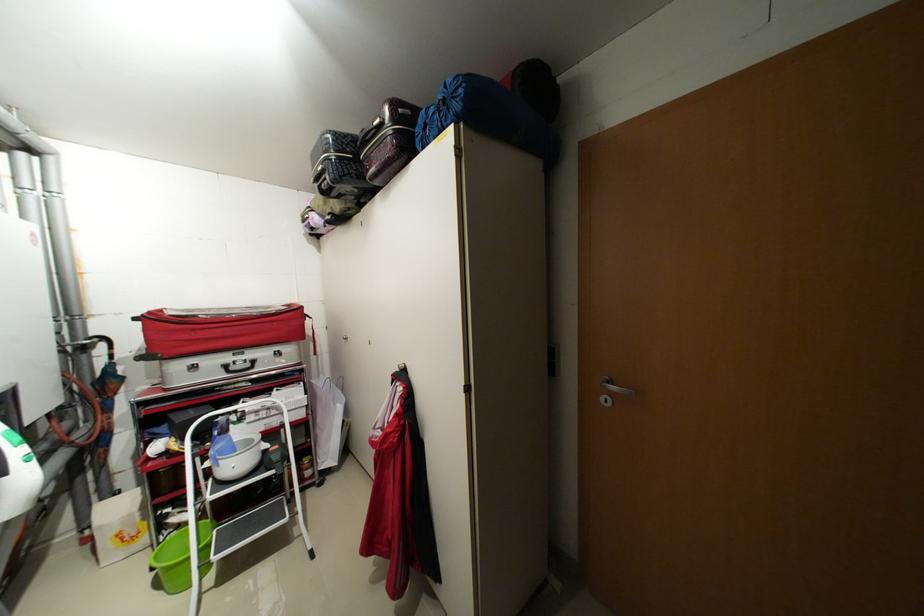
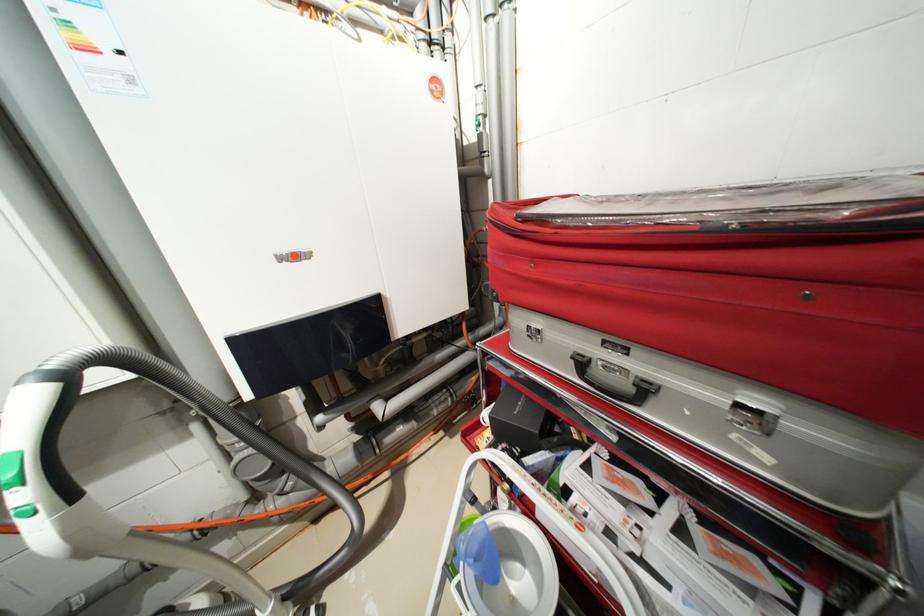
In the second image, find the point that corresponds to (234,368) in the first image.

(589, 363)